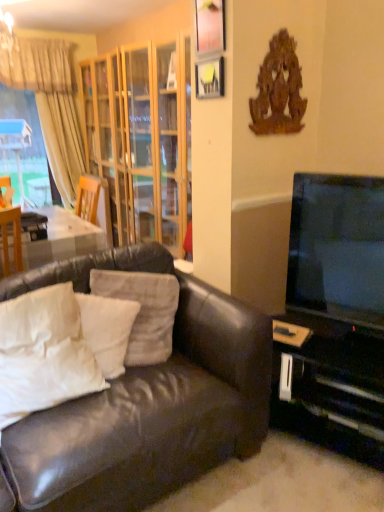
Question: Is wooden picture frame at upper center, which ranks as the 2th picture frame in bottom-to-top order, placed right next to beige fabric curtain at upper left?

Choices:
 (A) yes
 (B) no

Answer: (B)

Question: From a real-world perspective, is wooden picture frame at upper center, which ranks as the 2th picture frame in bottom-to-top order, located beneath beige fabric curtain at upper left?

Choices:
 (A) no
 (B) yes

Answer: (A)

Question: Could you tell me if wooden picture frame at upper center, which ranks as the first picture frame in top-to-bottom order, is facing beige fabric curtain at upper left?

Choices:
 (A) no
 (B) yes

Answer: (A)

Question: Can you confirm if wooden picture frame at upper center, which ranks as the first picture frame in top-to-bottom order, is thinner than beige fabric curtain at upper left?

Choices:
 (A) no
 (B) yes

Answer: (B)

Question: Is wooden picture frame at upper center, which ranks as the 2th picture frame in bottom-to-top order, further to camera compared to beige fabric curtain at upper left?

Choices:
 (A) no
 (B) yes

Answer: (A)

Question: Does wooden picture frame at upper center, which ranks as the first picture frame in top-to-bottom order, have a greater height compared to beige fabric curtain at upper left?

Choices:
 (A) yes
 (B) no

Answer: (B)

Question: Are white soft pillow at left, the 3th pillow in the right-to-left sequence, and flat screen tv at right located far from each other?

Choices:
 (A) yes
 (B) no

Answer: (A)

Question: Considering the relative sizes of white soft pillow at left, the 1th pillow from the left, and flat screen tv at right in the image provided, is white soft pillow at left, the 1th pillow from the left, shorter than flat screen tv at right?

Choices:
 (A) no
 (B) yes

Answer: (B)

Question: Considering the relative sizes of white soft pillow at left, the 3th pillow in the right-to-left sequence, and flat screen tv at right in the image provided, is white soft pillow at left, the 3th pillow in the right-to-left sequence, taller than flat screen tv at right?

Choices:
 (A) no
 (B) yes

Answer: (A)

Question: Is white soft pillow at left, the 3th pillow in the right-to-left sequence, positioned behind flat screen tv at right?

Choices:
 (A) yes
 (B) no

Answer: (B)

Question: From the image's perspective, does white soft pillow at left, the 1th pillow from the left, appear higher than flat screen tv at right?

Choices:
 (A) no
 (B) yes

Answer: (A)

Question: Is white soft pillow at left, the 3th pillow in the right-to-left sequence, to the right of flat screen tv at right from the viewer's perspective?

Choices:
 (A) yes
 (B) no

Answer: (B)

Question: Can you confirm if beige fabric curtain at upper left is positioned to the left of wooden picture frame at upper center, which ranks as the first picture frame in top-to-bottom order?

Choices:
 (A) yes
 (B) no

Answer: (A)